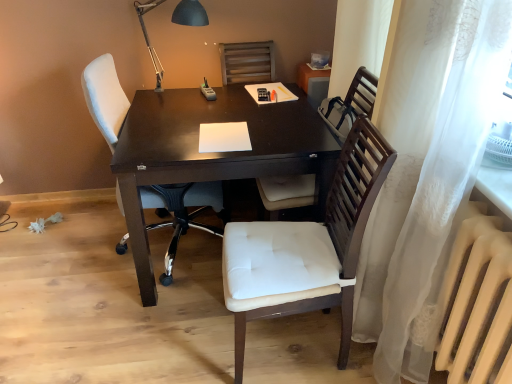
Question: Is wooden chair at center, the 1th chair from the right, positioned far away from white matte radiator at lower right?

Choices:
 (A) no
 (B) yes

Answer: (A)

Question: From the image's perspective, would you say wooden chair at center, the 3th chair viewed from the left, is positioned over white matte radiator at lower right?

Choices:
 (A) no
 (B) yes

Answer: (B)

Question: From the image's perspective, would you say wooden chair at center, the 3th chair viewed from the left, is shown under white matte radiator at lower right?

Choices:
 (A) no
 (B) yes

Answer: (A)

Question: Is wooden chair at center, the 1th chair from the right, smaller than white matte radiator at lower right?

Choices:
 (A) no
 (B) yes

Answer: (A)

Question: Considering the relative sizes of wooden chair at center, the 1th chair from the right, and white matte radiator at lower right in the image provided, is wooden chair at center, the 1th chair from the right, bigger than white matte radiator at lower right?

Choices:
 (A) yes
 (B) no

Answer: (A)

Question: In the image, is white matte radiator at lower right positioned in front of or behind wooden chair at center, the 3th chair viewed from the left?

Choices:
 (A) front
 (B) behind

Answer: (A)

Question: Is point (440, 311) closer or farther from the camera than point (372, 89)?

Choices:
 (A) farther
 (B) closer

Answer: (B)

Question: Based on their positions, is white matte radiator at lower right located to the left or right of wooden chair at center, the 1th chair from the right?

Choices:
 (A) right
 (B) left

Answer: (A)

Question: From the image's perspective, is white matte radiator at lower right above or below wooden chair at center, the 1th chair from the right?

Choices:
 (A) above
 (B) below

Answer: (B)

Question: From a real-world perspective, relative to black metal table lamp at upper center, is white fabric chair at left, which is the third chair from right to left, vertically above or below?

Choices:
 (A) above
 (B) below

Answer: (B)

Question: Relative to black metal table lamp at upper center, is white fabric chair at left, which is the third chair from right to left, in front or behind?

Choices:
 (A) front
 (B) behind

Answer: (A)

Question: From the image's perspective, is white fabric chair at left, which is counted as the first chair, starting from the left, above or below black metal table lamp at upper center?

Choices:
 (A) above
 (B) below

Answer: (B)

Question: Do you think white fabric chair at left, which is the third chair from right to left, is within black metal table lamp at upper center, or outside of it?

Choices:
 (A) outside
 (B) inside

Answer: (A)

Question: Considering the positions of white paper at center and black metal table lamp at upper center in the image, is white paper at center taller or shorter than black metal table lamp at upper center?

Choices:
 (A) short
 (B) tall

Answer: (A)

Question: In the image, is white paper at center positioned in front of or behind black metal table lamp at upper center?

Choices:
 (A) behind
 (B) front

Answer: (B)